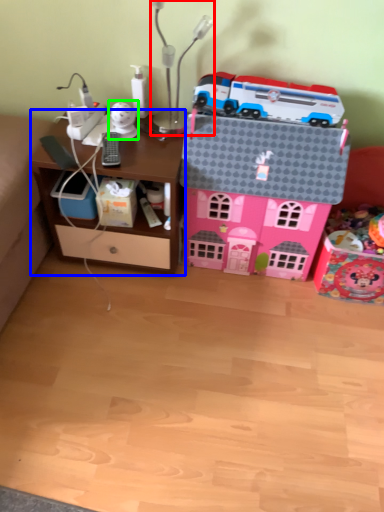
Question: Estimate the real-world distances between objects in this image. Which object is closer to table lamp (highlighted by a red box), computer desk (highlighted by a blue box) or toy (highlighted by a green box)?

Choices:
 (A) computer desk
 (B) toy

Answer: (B)